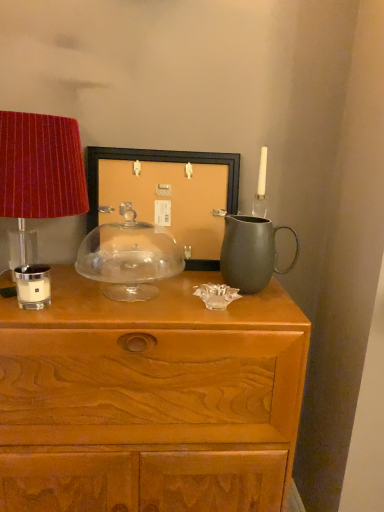
Image resolution: width=384 pixels, height=512 pixels. Identify the location of blank area beneath velvet red lampshade at left (from a real-world perspective). (59, 281).